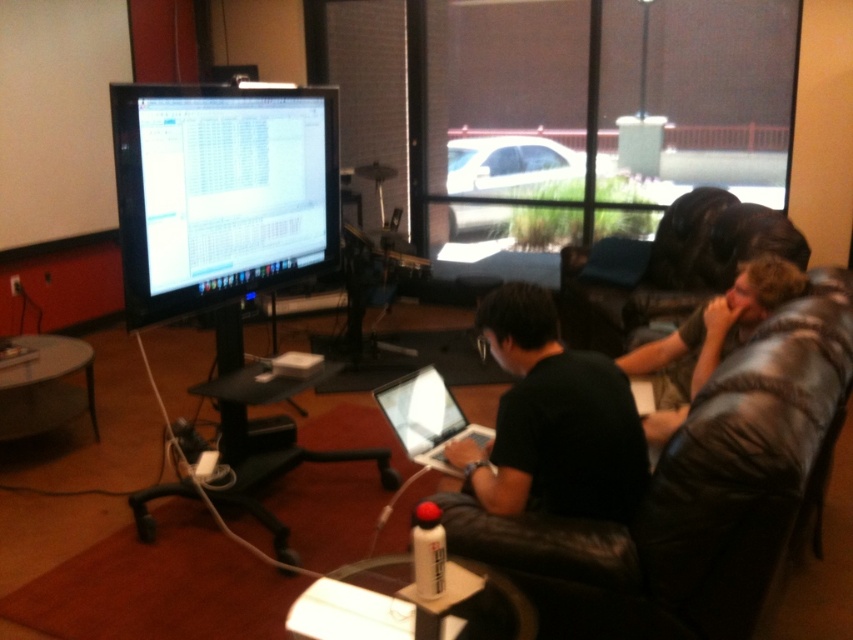
You are setting up a presentation and need to decide which device to use for displaying slides. Considering the black glossy monitor at upper left and the silver metallic laptop at center, which one is taller and thus better suited for a larger audience?

The black glossy monitor at upper left is taller than the silver metallic laptop at center, making it better suited for a larger audience.

You are a guest in this room and want to sit down. The black leather couch at center and the black matte laptop at center are both in your line of sight. Which one is closer to the floor?

The black leather couch at center is positioned under black matte laptop at center, so the black leather couch at center is closer to the floor.